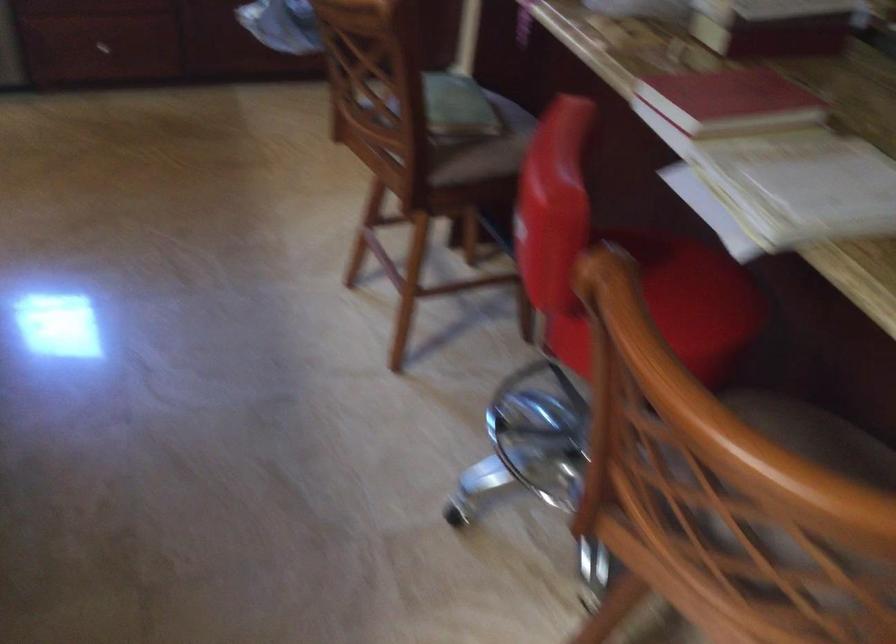
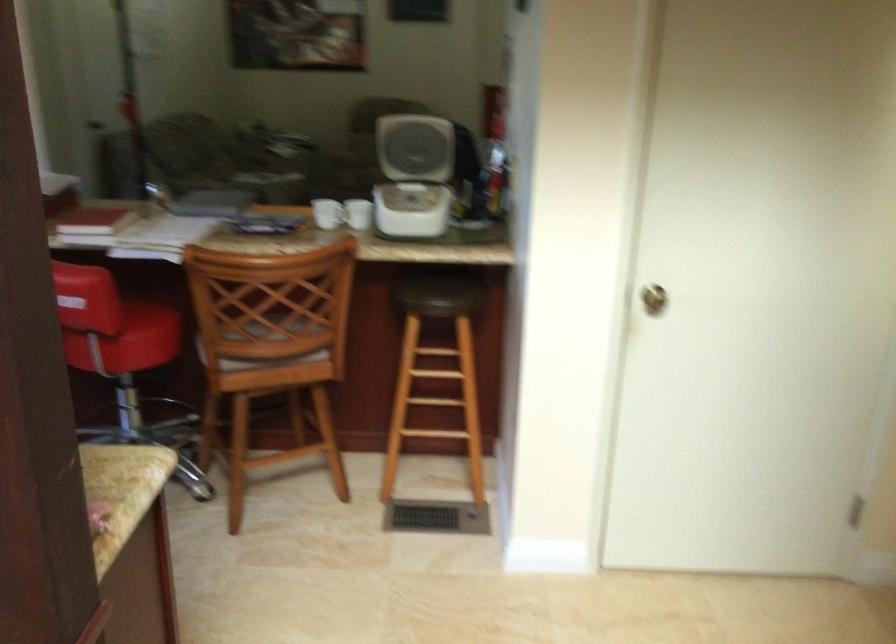
Question: I am providing you with two images of the same scene from different viewpoints. After the viewpoint changes to image2, which objects are now occluded?

Choices:
 (A) white coffee mug
 (B) red book
 (C) wooden chair sitting surface
 (D) wooden knife handle

Answer: (C)